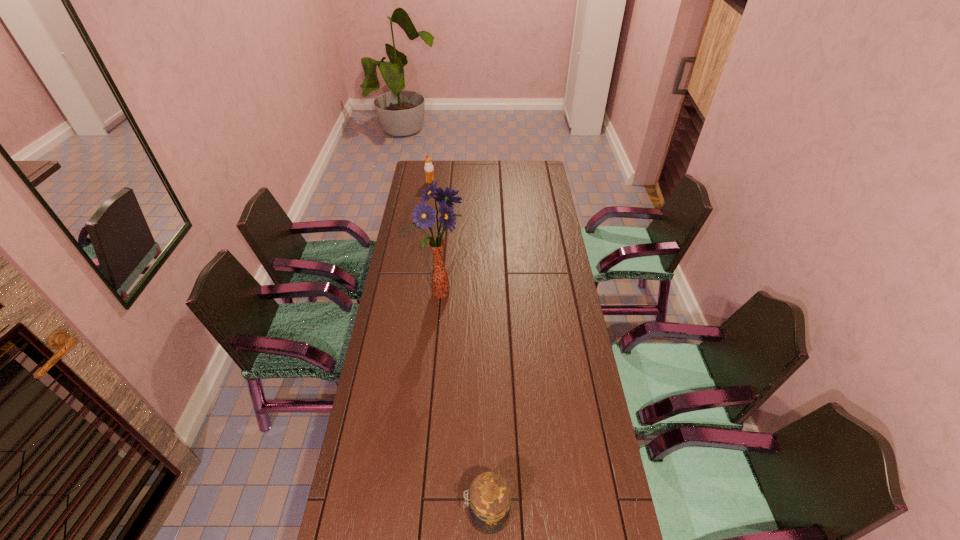
Find the location of `free space between the second farthest object and the jar`. free space between the second farthest object and the jar is located at coordinates (463, 404).

Locate an element on the screen. vacant region between the second farthest object and the nearest object is located at coordinates (463, 404).

Find the location of `vacant space in between the flower arrangement and the jar`. vacant space in between the flower arrangement and the jar is located at coordinates (463, 404).

I want to click on empty space that is in between the farthest object and the nearest object, so click(x=459, y=348).

This screenshot has height=540, width=960. In order to click on the closest object to the second farthest object in this screenshot , I will do `click(489, 507)`.

Select which object appears as the second closest to the nearest object. Please provide its 2D coordinates. Your answer should be formatted as a tuple, i.e. [(x, y)], where the tuple contains the x and y coordinates of a point satisfying the conditions above.

[(428, 168)]

You are a GUI agent. You are given a task and a screenshot of the screen. Output one action in this format:
    pyautogui.click(x=<x>, y=<y>)
    Task: Click on the free region that satisfies the following two spatial constraints: 1. at the front with a straw on the farthest object; 2. on the back side of the flower arrangement
    This screenshot has height=540, width=960.
    Given the screenshot: What is the action you would take?
    pyautogui.click(x=414, y=295)

Where is `blank area in the image that satisfies the following two spatial constraints: 1. at the front with a straw on the second farthest object; 2. on the right side of the icecream`? Image resolution: width=960 pixels, height=540 pixels. blank area in the image that satisfies the following two spatial constraints: 1. at the front with a straw on the second farthest object; 2. on the right side of the icecream is located at coordinates (414, 295).

Locate an element on the screen. This screenshot has width=960, height=540. vacant space that satisfies the following two spatial constraints: 1. at the front with a straw on the flower arrangement; 2. on the right side of the farthest object is located at coordinates (414, 295).